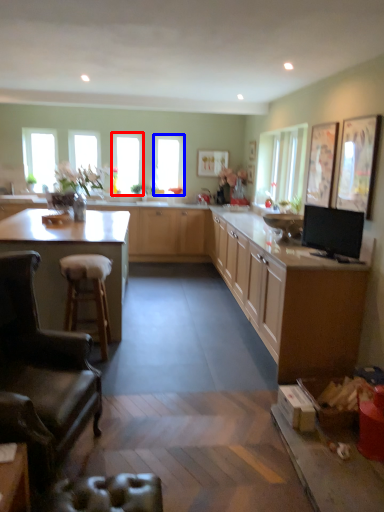
Question: Which point is further to the camera, window (highlighted by a red box) or window (highlighted by a blue box)?

Choices:
 (A) window
 (B) window

Answer: (B)